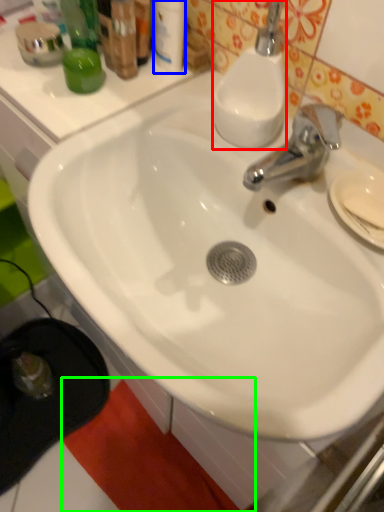
Question: Based on their relative distances, which object is farther from soap dispenser (highlighted by a red box)? Choose from toiletry (highlighted by a blue box) and beach towel (highlighted by a green box).

Choices:
 (A) toiletry
 (B) beach towel

Answer: (B)